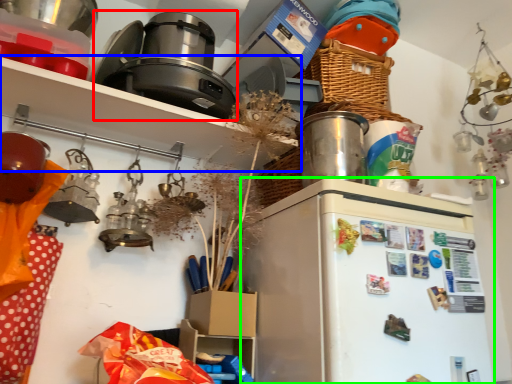
Question: Which object is the closest to the appliance (highlighted by a red box)? Choose among these: shelf (highlighted by a blue box) or fridge (highlighted by a green box).

Choices:
 (A) shelf
 (B) fridge

Answer: (A)